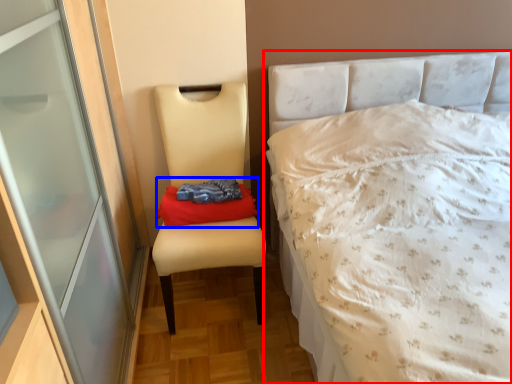
Question: Which object is further to the camera taking this photo, bed (highlighted by a red box) or material (highlighted by a blue box)?

Choices:
 (A) bed
 (B) material

Answer: (B)